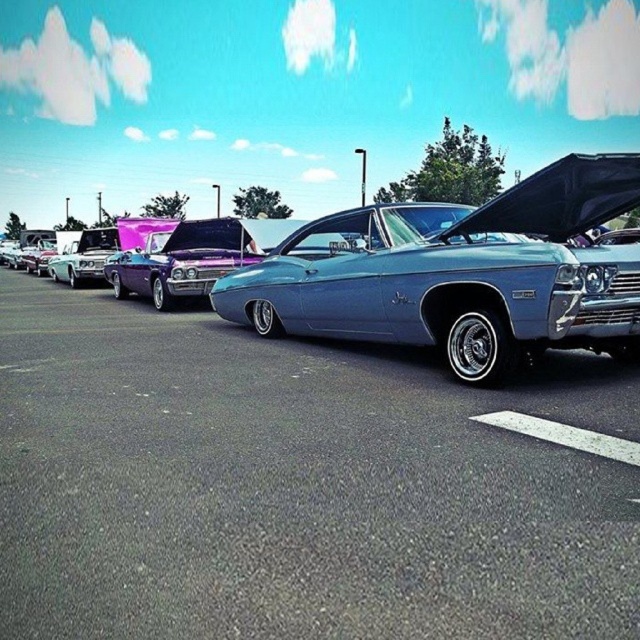
Question: Which point is closer to the camera?

Choices:
 (A) metallic blue muscle car at center
 (B) metallic blue car at center

Answer: (B)

Question: Which object is closer to the camera taking this photo?

Choices:
 (A) shiny chrome truck at left
 (B) metallic blue muscle car at center
 (C) metallic blue car at center
 (D) white asphalt line at center

Answer: (C)

Question: Is metallic blue muscle car at center closer to the viewer compared to shiny chrome truck at left?

Choices:
 (A) yes
 (B) no

Answer: (A)

Question: Which of these objects is positioned closest to the white asphalt line at center?

Choices:
 (A) shiny chrome truck at left
 (B) metallic blue muscle car at center
 (C) metallic blue car at center

Answer: (C)

Question: Is metallic blue muscle car at center to the left of shiny blue hood at center from the viewer's perspective?

Choices:
 (A) no
 (B) yes

Answer: (B)

Question: Can you confirm if metallic blue muscle car at center is positioned to the right of white asphalt line at center?

Choices:
 (A) yes
 (B) no

Answer: (B)